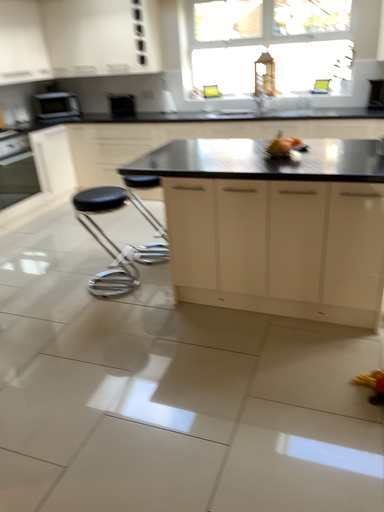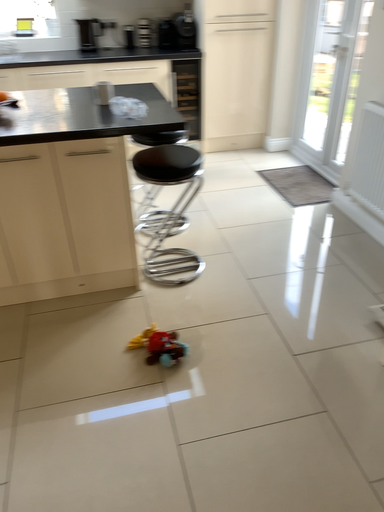
Question: Which way did the camera rotate in the video?

Choices:
 (A) rotated right
 (B) rotated left

Answer: (A)